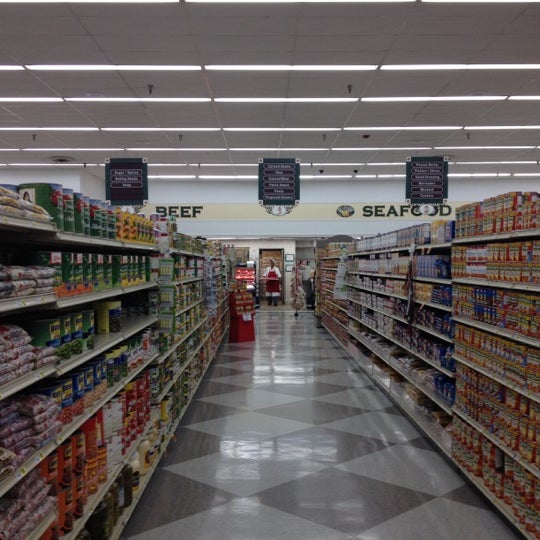
Where is `tray`? tray is located at coordinates (268, 276).